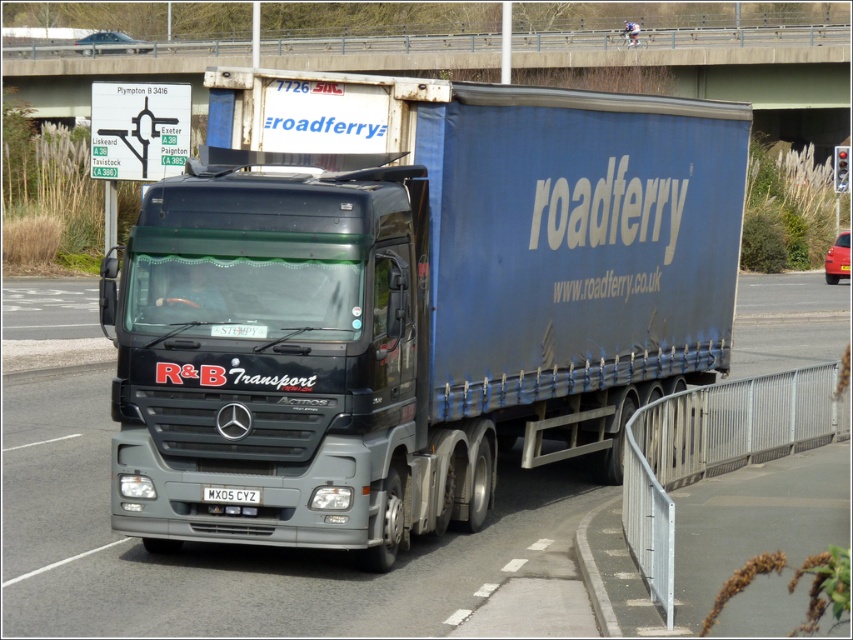
You are a traffic officer observing a metallic blue trailer truck at center and a white rectangular license plate at center. Which object is closer to you?

The metallic blue trailer truck at center is closer to you because it is positioned over the white rectangular license plate at center, indicating it is in front of the license plate.

You are a truck driver approaching a bridge with a height restriction sign. Your truck has a height of 4.2 meters. The point at coordinates (410, 301) marks the highest point of the metallic blue trailer truck at center. Can you safely pass under the bridge without hitting the overhead structure?

The point at coordinates (410, 301) indicates the highest point of the metallic blue trailer truck at center. Since your truck is 4.2 meters tall and the highest point of the truck in the image is at that coordinate, you can safely pass under the bridge as long as the bridge allows vehicles up to at least 4.2 meters in height. The image does not provide specific height measurements for the bridge, so you should check the height restriction sign before proceeding.

You are a traffic officer checking vehicle dimensions. The license plate must be visible and not obscured by any part of the vehicle. Based on the scene, will the license plate on the white rectangular license plate at center be visible to you while the metallic gray truck at center is moving?

The metallic gray truck at center is much taller than the white rectangular license plate at center, so the license plate will be visible as it is not obscured by the truck.